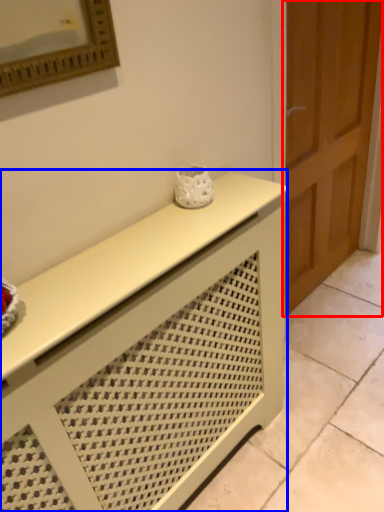
Question: Among these objects, which one is farthest to the camera, door (highlighted by a red box) or furniture (highlighted by a blue box)?

Choices:
 (A) door
 (B) furniture

Answer: (A)